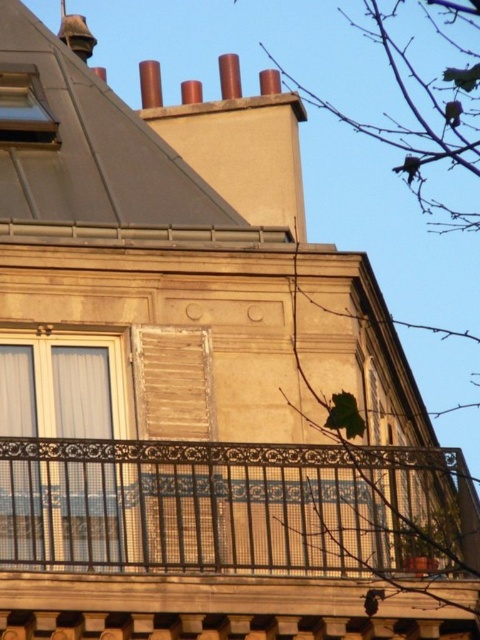
Question: Which object is farther from the camera taking this photo?

Choices:
 (A) black wrought iron balcony at center
 (B) wooden at center
 (C) white glass window at left
 (D) matte glass window at upper left

Answer: (D)

Question: In this image, where is black wrought iron balcony at center located relative to matte glass window at upper left?

Choices:
 (A) below
 (B) above

Answer: (A)

Question: Is white glass window at left above matte glass window at upper left?

Choices:
 (A) yes
 (B) no

Answer: (B)

Question: Which object appears closest to the camera in this image?

Choices:
 (A) matte glass window at upper left
 (B) wooden at center
 (C) black wrought iron balcony at center

Answer: (C)

Question: Does black wrought iron balcony at center have a larger size compared to wooden at center?

Choices:
 (A) no
 (B) yes

Answer: (B)

Question: Which object appears farthest from the camera in this image?

Choices:
 (A) white glass window at left
 (B) wooden at center
 (C) black wrought iron balcony at center
 (D) matte glass window at upper left

Answer: (D)